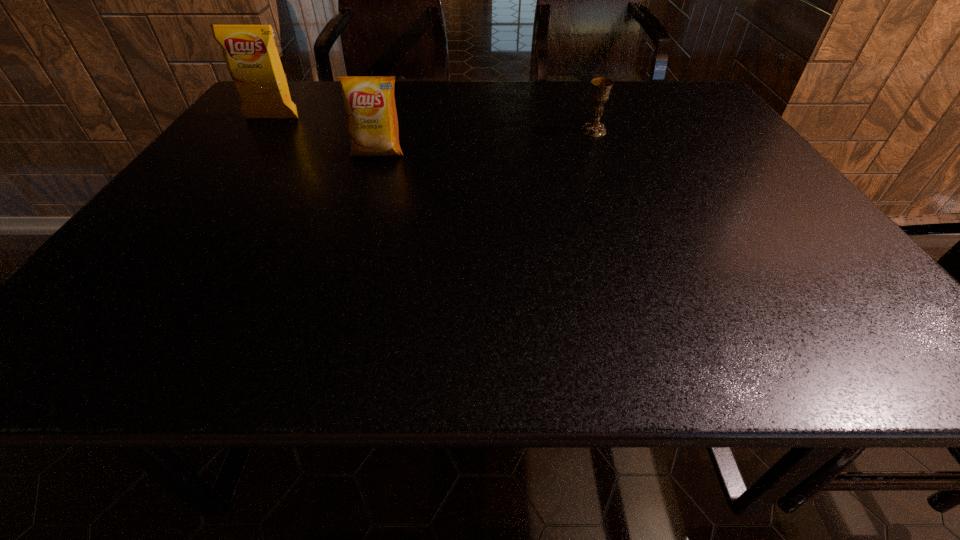
The image size is (960, 540). What are the coordinates of `object at the left edge` in the screenshot? It's located at (250, 52).

This screenshot has width=960, height=540. Find the location of `object located at the far left corner`. object located at the far left corner is located at coordinates (250, 52).

In the image, there is a desktop. Identify the location of vacant area at the far edge. (400, 104).

In the image, there is a desktop. Where is `vacant space at the near edge`? vacant space at the near edge is located at coordinates (339, 347).

The image size is (960, 540). Identify the location of vacant space at the left edge of the desktop. (245, 178).

Where is `vacant space at the right edge`? The image size is (960, 540). vacant space at the right edge is located at coordinates (816, 266).

Where is `vacant region at the near left corner`? The height and width of the screenshot is (540, 960). vacant region at the near left corner is located at coordinates (106, 325).

At what (x,y) coordinates should I click in order to perform the action: click on free space between the chalice and the shorter crisp (potato chip). Please return your answer as a coordinate pair (x, y). Looking at the image, I should click on click(x=486, y=142).

I want to click on empty location between the tallest object and the rightmost object, so click(433, 125).

Locate an element on the screen. The width and height of the screenshot is (960, 540). vacant area between the right crisp (potato chip) and the second farthest object is located at coordinates (486, 142).